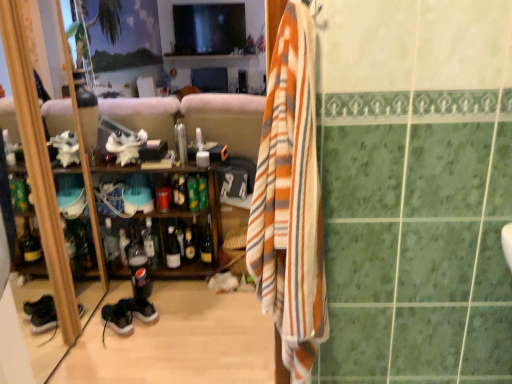
Question: Is suede black shoe at lower left further to camera compared to shiny gold bottle at center, the ninth bottle viewed from the left?

Choices:
 (A) yes
 (B) no

Answer: (B)

Question: Does suede black shoe at lower left lie in front of shiny gold bottle at center, the 1th bottle from the right?

Choices:
 (A) no
 (B) yes

Answer: (B)

Question: Considering the relative positions of suede black shoe at lower left and shiny gold bottle at center, the 1th bottle from the right, in the image provided, is suede black shoe at lower left to the right of shiny gold bottle at center, the 1th bottle from the right, from the viewer's perspective?

Choices:
 (A) no
 (B) yes

Answer: (A)

Question: Does suede black shoe at lower left have a lesser width compared to shiny gold bottle at center, the ninth bottle viewed from the left?

Choices:
 (A) no
 (B) yes

Answer: (A)

Question: From the image's perspective, is suede black shoe at lower left located beneath shiny gold bottle at center, the ninth bottle viewed from the left?

Choices:
 (A) yes
 (B) no

Answer: (A)

Question: From the image's perspective, is matte plastic soda bottle at center, placed as the seventh bottle when sorted from right to left, located above or below translucent plastic bottle at center, arranged as the eighth bottle when viewed from the right?

Choices:
 (A) above
 (B) below

Answer: (B)

Question: Is point [x=139, y=256] closer or farther from the camera than point [x=124, y=258]?

Choices:
 (A) farther
 (B) closer

Answer: (B)

Question: Considering the positions of matte plastic soda bottle at center, the 3th bottle from the left, and translucent plastic bottle at center, arranged as the eighth bottle when viewed from the right, in the image, is matte plastic soda bottle at center, the 3th bottle from the left, bigger or smaller than translucent plastic bottle at center, arranged as the eighth bottle when viewed from the right,?

Choices:
 (A) big
 (B) small

Answer: (A)

Question: From a real-world perspective, is matte plastic soda bottle at center, the 3th bottle from the left, physically located above or below translucent plastic bottle at center, which appears as the 2th bottle when viewed from the left?

Choices:
 (A) above
 (B) below

Answer: (B)

Question: From their relative heights in the image, would you say wooden shelf at center is taller or shorter than matte plastic soda bottle at center, placed as the seventh bottle when sorted from right to left?

Choices:
 (A) tall
 (B) short

Answer: (A)

Question: Is wooden shelf at center bigger or smaller than matte plastic soda bottle at center, placed as the seventh bottle when sorted from right to left?

Choices:
 (A) small
 (B) big

Answer: (B)

Question: From the image's perspective, is wooden shelf at center above or below matte plastic soda bottle at center, placed as the seventh bottle when sorted from right to left?

Choices:
 (A) above
 (B) below

Answer: (A)

Question: In the image, is wooden shelf at center positioned in front of or behind matte plastic soda bottle at center, placed as the seventh bottle when sorted from right to left?

Choices:
 (A) front
 (B) behind

Answer: (A)

Question: In terms of height, does green glass bottle at center, positioned as the eighth bottle in left-to-right order, look taller or shorter compared to shiny dark glass bottle at center, acting as the third bottle starting from the right?

Choices:
 (A) short
 (B) tall

Answer: (A)

Question: Considering the positions of green glass bottle at center, which appears as the 2th bottle when viewed from the right, and shiny dark glass bottle at center, which appears as the 7th bottle when viewed from the left, in the image, is green glass bottle at center, which appears as the 2th bottle when viewed from the right, bigger or smaller than shiny dark glass bottle at center, which appears as the 7th bottle when viewed from the left,?

Choices:
 (A) small
 (B) big

Answer: (B)